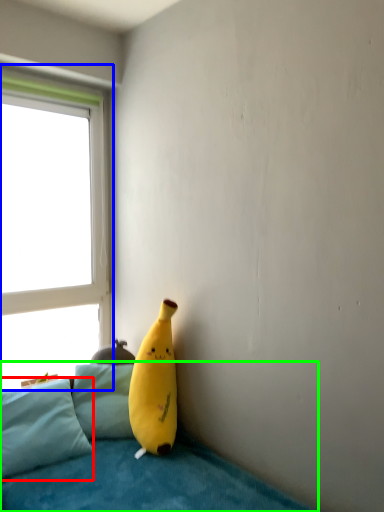
Question: Considering the real-world distances, which object is closest to pillow (highlighted by a red box)? window (highlighted by a blue box) or studio couch (highlighted by a green box).

Choices:
 (A) window
 (B) studio couch

Answer: (B)